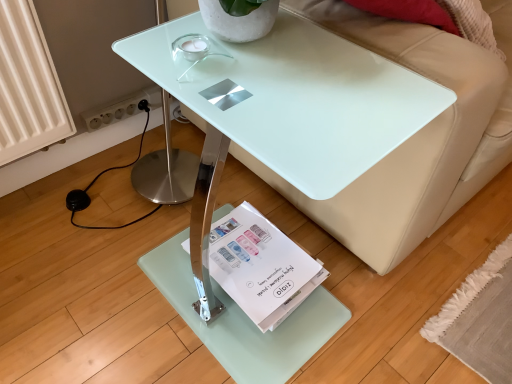
This screenshot has width=512, height=384. I want to click on blank space situated above white paper magazine at lower center (from a real-world perspective), so click(252, 249).